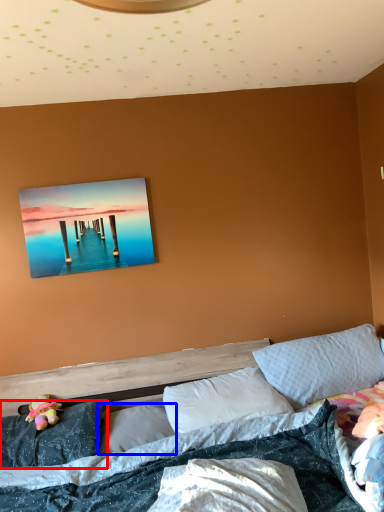
Question: Which object is closer to the camera taking this photo, pillow (highlighted by a red box) or pillow (highlighted by a blue box)?

Choices:
 (A) pillow
 (B) pillow

Answer: (A)